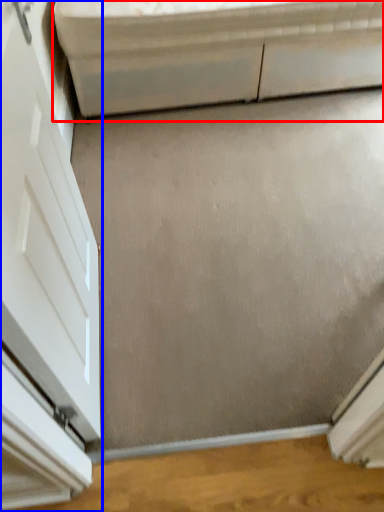
Question: Which object is closer to the camera taking this photo, furniture (highlighted by a red box) or door (highlighted by a blue box)?

Choices:
 (A) furniture
 (B) door

Answer: (B)